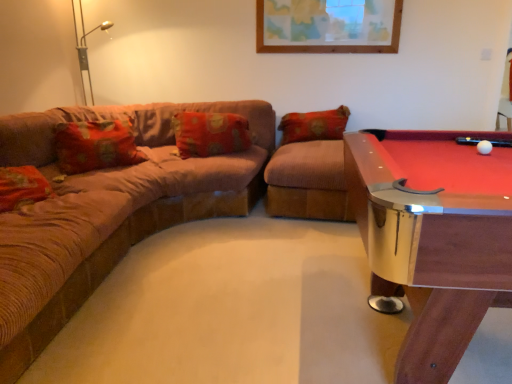
Question: From a real-world perspective, is floral fabric pillow at center above or below wooden pool table at right?

Choices:
 (A) below
 (B) above

Answer: (B)

Question: Looking at the image, does floral fabric pillow at center seem bigger or smaller compared to wooden pool table at right?

Choices:
 (A) big
 (B) small

Answer: (B)

Question: Which object is the farthest from the wooden pool table at right?

Choices:
 (A) floral fabric pillow at center
 (B) brown corduroy couch at left

Answer: (A)

Question: Which object is positioned farthest from the brown corduroy couch at left?

Choices:
 (A) floral fabric pillow at center
 (B) wooden pool table at right

Answer: (B)